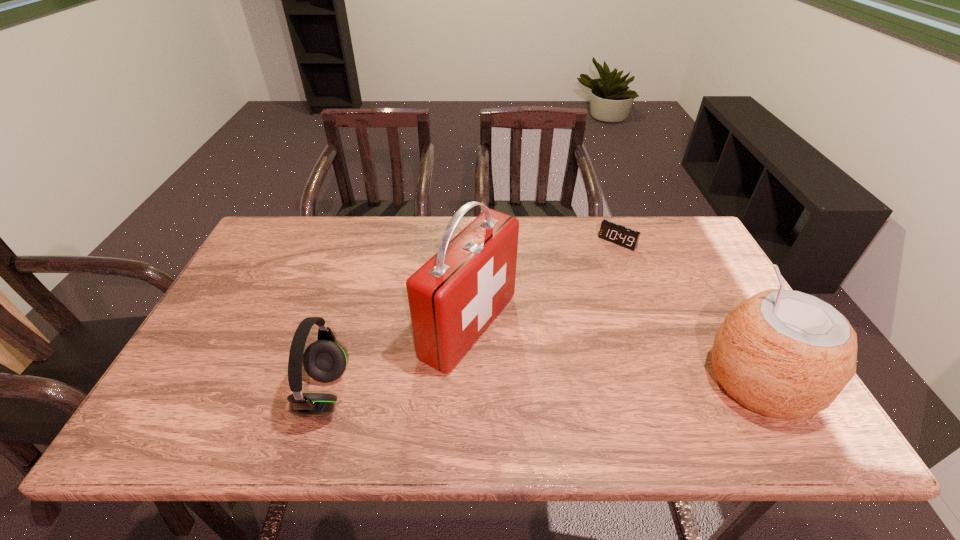
Identify the location of coconut present at the near edge. (785, 354).

You are a GUI agent. You are given a task and a screenshot of the screen. Output one action in this format:
    pyautogui.click(x=<x>, y=<y>)
    Task: Click on the first-aid kit that is positioned at the near edge
    This screenshot has height=540, width=960.
    Given the screenshot: What is the action you would take?
    pyautogui.click(x=453, y=297)

Identify the location of object located at the right edge. The width and height of the screenshot is (960, 540). (785, 354).

The height and width of the screenshot is (540, 960). I want to click on object that is at the near right corner, so click(x=785, y=354).

In the image, there is a desktop. Find the location of `vacant region at the far edge`. vacant region at the far edge is located at coordinates (421, 224).

Identify the location of free space at the near edge of the desktop. (654, 373).

Where is `free spot at the left edge of the desktop`? The width and height of the screenshot is (960, 540). free spot at the left edge of the desktop is located at coordinates (243, 299).

You are a GUI agent. You are given a task and a screenshot of the screen. Output one action in this format:
    pyautogui.click(x=<x>, y=<y>)
    Task: Click on the free region at the right edge of the desktop
    
    Given the screenshot: What is the action you would take?
    pyautogui.click(x=717, y=282)

In the image, there is a desktop. Find the location of `vacant space at the far right corner`. vacant space at the far right corner is located at coordinates pyautogui.click(x=681, y=223).

You are a GUI agent. You are given a task and a screenshot of the screen. Output one action in this format:
    pyautogui.click(x=<x>, y=<y>)
    Task: Click on the vacant area that lies between the first-aid kit and the rightmost object
    
    Given the screenshot: What is the action you would take?
    pyautogui.click(x=614, y=354)